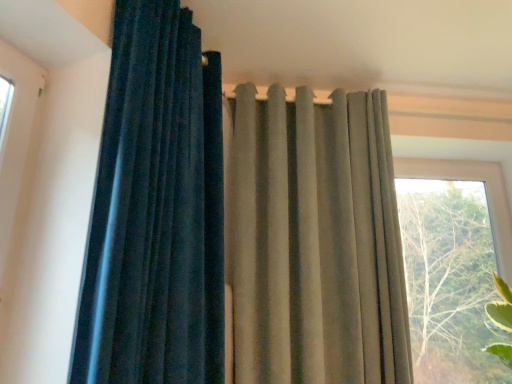
Question: Is transparent glass window at right at the left side of velvet dark blue curtain at left, positioned as the second curtain in right-to-left order?

Choices:
 (A) yes
 (B) no

Answer: (B)

Question: Considering the relative sizes of transparent glass window at right and velvet dark blue curtain at left, acting as the first curtain starting from the left, in the image provided, is transparent glass window at right wider than velvet dark blue curtain at left, acting as the first curtain starting from the left,?

Choices:
 (A) no
 (B) yes

Answer: (A)

Question: Is velvet dark blue curtain at left, acting as the first curtain starting from the left, a part of transparent glass window at right?

Choices:
 (A) yes
 (B) no

Answer: (B)

Question: Could you tell me if transparent glass window at right is turned towards velvet dark blue curtain at left, positioned as the second curtain in right-to-left order?

Choices:
 (A) no
 (B) yes

Answer: (A)

Question: Considering the relative sizes of transparent glass window at right and velvet dark blue curtain at left, positioned as the second curtain in right-to-left order, in the image provided, is transparent glass window at right thinner than velvet dark blue curtain at left, positioned as the second curtain in right-to-left order,?

Choices:
 (A) no
 (B) yes

Answer: (B)

Question: Visually, is satin beige curtain at upper center, which is the 1th curtain in right-to-left order, positioned to the left or to the right of transparent glass window at right?

Choices:
 (A) right
 (B) left

Answer: (B)

Question: In the image, is satin beige curtain at upper center, which is the second curtain from left to right, positioned in front of or behind transparent glass window at right?

Choices:
 (A) behind
 (B) front

Answer: (B)

Question: Is satin beige curtain at upper center, which is the 1th curtain in right-to-left order, bigger or smaller than transparent glass window at right?

Choices:
 (A) big
 (B) small

Answer: (A)

Question: Is point (292, 187) positioned closer to the camera than point (409, 188)?

Choices:
 (A) farther
 (B) closer

Answer: (B)

Question: Considering the positions of transparent glass window at right and satin beige curtain at upper center, which is the 1th curtain in right-to-left order, in the image, is transparent glass window at right wider or thinner than satin beige curtain at upper center, which is the 1th curtain in right-to-left order,?

Choices:
 (A) wide
 (B) thin

Answer: (B)

Question: From a real-world perspective, is transparent glass window at right positioned above or below satin beige curtain at upper center, which is the second curtain from left to right?

Choices:
 (A) below
 (B) above

Answer: (A)

Question: Considering their positions, is transparent glass window at right located in front of or behind satin beige curtain at upper center, which is the 1th curtain in right-to-left order?

Choices:
 (A) behind
 (B) front

Answer: (A)

Question: From the image's perspective, is transparent glass window at right located above or below satin beige curtain at upper center, which is the second curtain from left to right?

Choices:
 (A) above
 (B) below

Answer: (B)

Question: Considering their positions, is velvet dark blue curtain at left, acting as the first curtain starting from the left, located in front of or behind transparent glass window at right?

Choices:
 (A) front
 (B) behind

Answer: (A)

Question: Is velvet dark blue curtain at left, positioned as the second curtain in right-to-left order, wider or thinner than transparent glass window at right?

Choices:
 (A) thin
 (B) wide

Answer: (B)